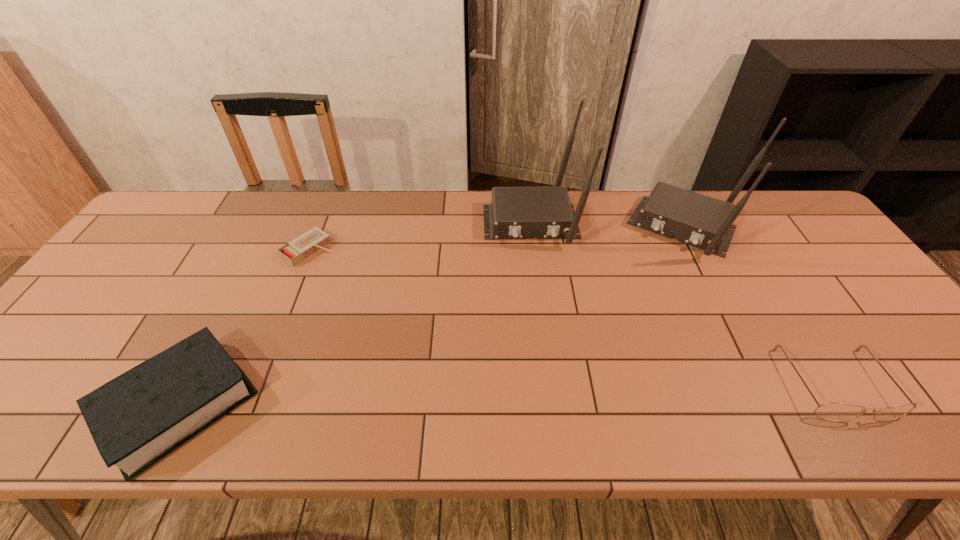
Image resolution: width=960 pixels, height=540 pixels. I want to click on vacant space at the far edge of the desktop, so (389, 233).

The height and width of the screenshot is (540, 960). Find the location of `vacant space at the near edge of the desktop`. vacant space at the near edge of the desktop is located at coordinates (587, 373).

At what (x,y) coordinates should I click in order to perform the action: click on free space at the left edge. Please return your answer as a coordinate pair (x, y). Looking at the image, I should click on (60, 356).

Find the location of a particular element. This screenshot has height=540, width=960. free location at the right edge of the desktop is located at coordinates (777, 242).

What are the coordinates of `vacant space at the far right corner` in the screenshot? It's located at (752, 197).

Identify the location of vacant space that is in between the third object from left to right and the right router. (609, 225).

In order to click on vacant area that lies between the third object from left to right and the spectacles in this screenshot , I will do `click(684, 302)`.

You are a GUI agent. You are given a task and a screenshot of the screen. Output one action in this format:
    pyautogui.click(x=<x>, y=<y>)
    Task: Click on the free space between the right router and the shortest object
    This screenshot has height=540, width=960.
    Given the screenshot: What is the action you would take?
    pyautogui.click(x=498, y=239)

Where is `vacant area between the spectacles and the left router`? This screenshot has width=960, height=540. vacant area between the spectacles and the left router is located at coordinates (684, 302).

Where is `unoccupied position between the matchbox and the third object from right to left`? Image resolution: width=960 pixels, height=540 pixels. unoccupied position between the matchbox and the third object from right to left is located at coordinates (420, 235).